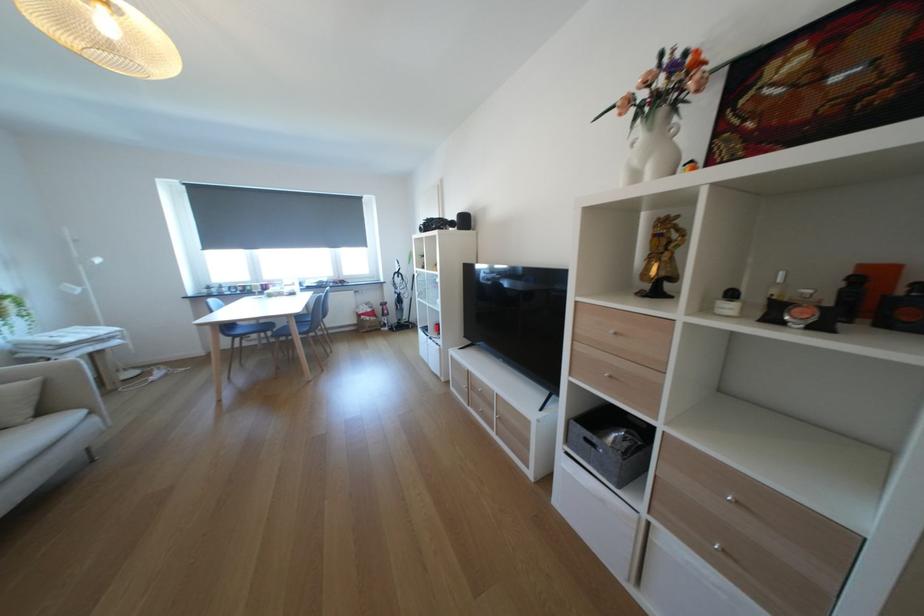
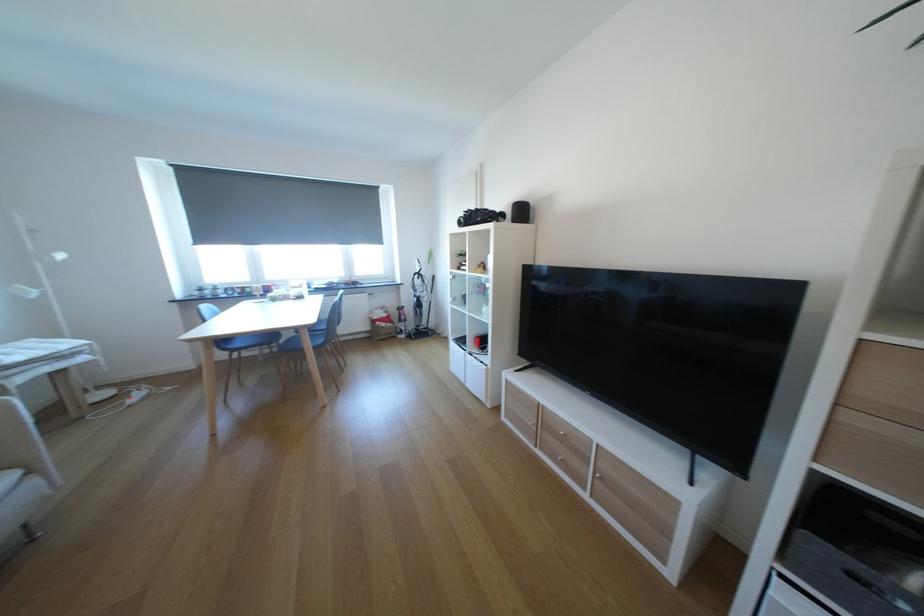
The point at (366, 323) is marked in the first image. Where is the corresponding point in the second image?

(379, 329)